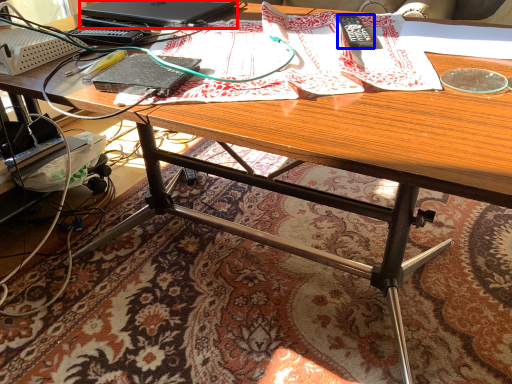
Question: Which object appears farthest to the camera in this image, laptop (highlighted by a red box) or remote control (highlighted by a blue box)?

Choices:
 (A) laptop
 (B) remote control

Answer: (A)